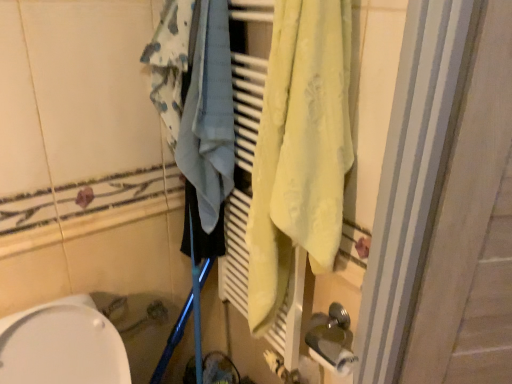
Question: Considering their positions, is white matte toilet paper at lower right located in front of or behind light blue fabric at center?

Choices:
 (A) behind
 (B) front

Answer: (A)

Question: In the image, is white matte toilet paper at lower right on the left side or the right side of light blue fabric at center?

Choices:
 (A) left
 (B) right

Answer: (B)

Question: Estimate the real-world distances between objects in this image. Which object is farther from the white glossy toilet at lower left?

Choices:
 (A) light blue fabric at center
 (B) white striped screen door at right
 (C) white matte toilet paper at lower right

Answer: (B)

Question: Estimate the real-world distances between objects in this image. Which object is farther from the light blue fabric at center?

Choices:
 (A) white matte toilet paper at lower right
 (B) white striped screen door at right
 (C) white glossy toilet at lower left

Answer: (A)